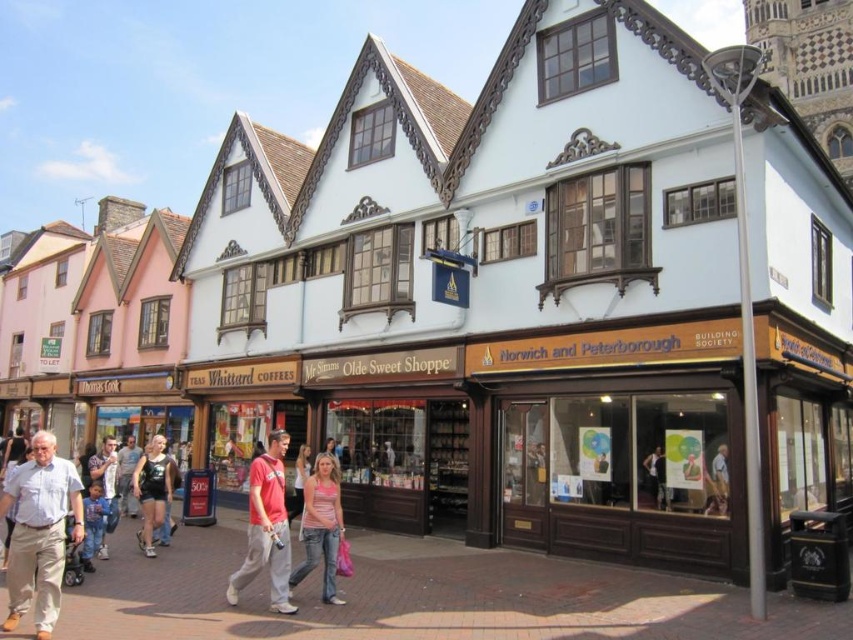
Question: Is matte black shorts at center in front of light brown wooden frame at center?

Choices:
 (A) yes
 (B) no

Answer: (B)

Question: Which of these objects is positioned farthest from the denim jeans at lower left?

Choices:
 (A) dark blue jeans at center
 (B) light brown wooden frame at center
 (C) matte red t-shirt at center

Answer: (B)

Question: Does light blue cotton shirt at lower left appear on the left side of denim jeans at lower left?

Choices:
 (A) no
 (B) yes

Answer: (A)

Question: Which of these objects is positioned closest to the light brown wooden frame at center?

Choices:
 (A) light blue cotton shirt at lower left
 (B) blue denim jeans at lower left
 (C) pink denim jeans at center
 (D) denim jeans at lower left

Answer: (C)

Question: Can you confirm if matte red t-shirt at center is thinner than matte black shorts at center?

Choices:
 (A) no
 (B) yes

Answer: (B)

Question: Which point is closer to the camera?

Choices:
 (A) (26, 545)
 (B) (140, 548)

Answer: (A)